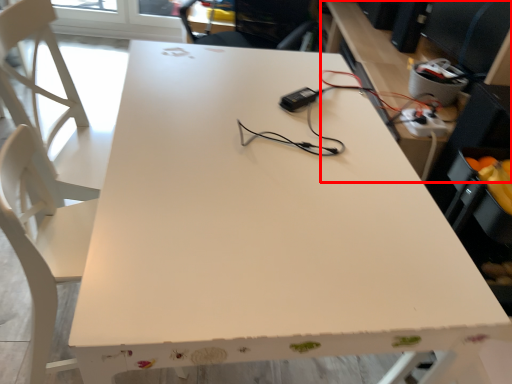
Question: In this image, where is computer desk (annotated by the red box) located relative to extension cord?

Choices:
 (A) left
 (B) right

Answer: (B)